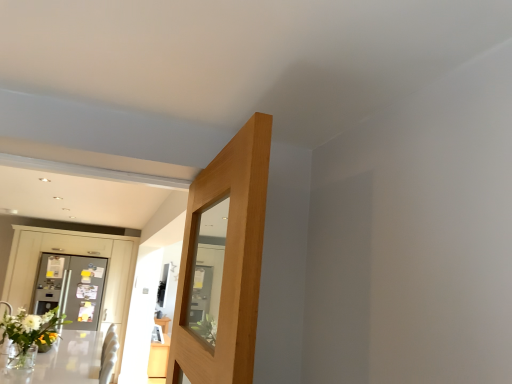
Question: Is clear glass table at lower left, placed as the second table when sorted from bottom to top, not within light wood table at lower left, which appears as the first table when ordered from the bottom?

Choices:
 (A) yes
 (B) no

Answer: (A)

Question: Is clear glass table at lower left, placed as the second table when sorted from bottom to top, thinner than light wood table at lower left, which appears as the second table when viewed from the top?

Choices:
 (A) yes
 (B) no

Answer: (B)

Question: Is clear glass table at lower left, the first table from the front, oriented towards light wood table at lower left, which is the second table from front to back?

Choices:
 (A) yes
 (B) no

Answer: (B)

Question: Is clear glass table at lower left, marked as the second table in a back-to-front arrangement, closer to camera compared to light wood table at lower left, the first table in the back-to-front sequence?

Choices:
 (A) yes
 (B) no

Answer: (A)

Question: Is clear glass table at lower left, which is the 1th table in top-to-bottom order, wider than light wood table at lower left, which appears as the second table when viewed from the top?

Choices:
 (A) yes
 (B) no

Answer: (A)

Question: Is clear glass table at lower left, placed as the second table when sorted from bottom to top, to the left of light wood table at lower left, which is the second table from front to back, from the viewer's perspective?

Choices:
 (A) no
 (B) yes

Answer: (B)

Question: From the image's perspective, is light wood table at lower left, which appears as the second table when viewed from the top, located above metallic gray dresser at left?

Choices:
 (A) yes
 (B) no

Answer: (B)

Question: Is light wood table at lower left, the first table in the back-to-front sequence, positioned in front of metallic gray dresser at left?

Choices:
 (A) no
 (B) yes

Answer: (A)

Question: Is the depth of light wood table at lower left, which is the second table from front to back, greater than that of metallic gray dresser at left?

Choices:
 (A) no
 (B) yes

Answer: (B)

Question: Considering the relative sizes of light wood table at lower left, which is the second table from front to back, and metallic gray dresser at left in the image provided, is light wood table at lower left, which is the second table from front to back, shorter than metallic gray dresser at left?

Choices:
 (A) yes
 (B) no

Answer: (A)

Question: Does light wood table at lower left, which appears as the second table when viewed from the top, have a larger size compared to metallic gray dresser at left?

Choices:
 (A) yes
 (B) no

Answer: (B)

Question: Is light wood table at lower left, which is the second table from front to back, next to metallic gray dresser at left?

Choices:
 (A) no
 (B) yes

Answer: (A)

Question: Considering the relative sizes of clear glass table at lower left, the first table from the front, and metallic gray dresser at left in the image provided, is clear glass table at lower left, the first table from the front, smaller than metallic gray dresser at left?

Choices:
 (A) yes
 (B) no

Answer: (A)